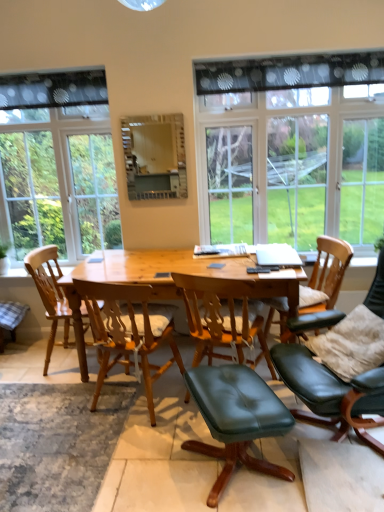
What is the approximate height of black dotted fabric at upper left?

The height of black dotted fabric at upper left is 10.83 inches.

At what (x,y) coordinates should I click in order to perform the action: click on black dotted fabric at upper left. Please return your answer as a coordinate pair (x, y). Looking at the image, I should click on (53, 89).

The height and width of the screenshot is (512, 384). Describe the element at coordinates (169, 280) in the screenshot. I see `natural wood table at center` at that location.

Measure the distance between point [153,423] and camera.

Point [153,423] and camera are 2.39 meters apart.

I want to click on leather cushioned chair at center, which ranks as the 2th chair in right-to-left order, so click(x=220, y=321).

At what (x,y) coordinates should I click in order to perform the action: click on green leather stool at lower center. Please return your answer as a coordinate pair (x, y). Image resolution: width=384 pixels, height=512 pixels. Looking at the image, I should click on (236, 418).

At what (x,y) coordinates should I click in order to perform the action: click on wooden chair at left, the 1th chair from the left. Please return your answer as a coordinate pair (x, y). Image resolution: width=384 pixels, height=512 pixels. Looking at the image, I should click on (49, 293).

What do you see at coordinates (291, 149) in the screenshot? The image size is (384, 512). I see `transparent glass window at upper center, which is the 2th window from left to right` at bounding box center [291, 149].

Find the location of `black dotted fabric at upper left`. black dotted fabric at upper left is located at coordinates (53, 89).

Considering the positions of objects black leather chair at right, the 4th chair from the left, and wooden chair at left, the 1th chair from the left, in the image provided, who is behind, black leather chair at right, the 4th chair from the left, or wooden chair at left, the 1th chair from the left,?

wooden chair at left, the 1th chair from the left, is more distant.

Is black leather chair at right, the 4th chair from the left, facing away from wooden chair at left, the 1th chair from the left?

No, black leather chair at right, the 4th chair from the left, is not facing away from wooden chair at left, the 1th chair from the left.

Which object is thinner, black leather chair at right, the 1th chair in the right-to-left sequence, or wooden chair at left, which is the 4th chair in right-to-left order?

Thinner between the two is wooden chair at left, which is the 4th chair in right-to-left order.

Can you confirm if black leather chair at right, the 1th chair in the right-to-left sequence, is positioned to the left of wooden chair at left, the 1th chair from the left?

No.

From the image's perspective, which one is positioned higher, black leather chair at right, the 4th chair from the left, or black dotted fabric at upper left?

black dotted fabric at upper left, from the image's perspective.

From a real-world perspective, which chair is the 1st one underneath the black dotted fabric at upper left? Please provide its 2D coordinates.

[(331, 393)]

From the picture: Which is more to the left, black leather chair at right, the 4th chair from the left, or black dotted fabric at upper left?

black dotted fabric at upper left.

How different are the orientations of black leather chair at right, the 4th chair from the left, and black dotted fabric at upper left in degrees?

71.7 degrees separate the facing orientations of black leather chair at right, the 4th chair from the left, and black dotted fabric at upper left.

Does natural wood table at center appear on the right side of wooden chair at left, which is the 4th chair in right-to-left order?

Yes, natural wood table at center is to the right of wooden chair at left, which is the 4th chair in right-to-left order.

Do you think natural wood table at center is within wooden chair at left, the 1th chair from the left, or outside of it?

natural wood table at center is located beyond the bounds of wooden chair at left, the 1th chair from the left.

From a real-world perspective, is natural wood table at center above or below wooden chair at left, which is the 4th chair in right-to-left order?

natural wood table at center is below wooden chair at left, which is the 4th chair in right-to-left order.

Considering the relative sizes of black leather chair at right, the 1th chair in the right-to-left sequence, and green leather stool at lower center in the image provided, is black leather chair at right, the 1th chair in the right-to-left sequence, wider than green leather stool at lower center?

Indeed, black leather chair at right, the 1th chair in the right-to-left sequence, has a greater width compared to green leather stool at lower center.

Is point (289, 386) closer to camera compared to point (234, 431)?

No, it is not.

Between black leather chair at right, the 4th chair from the left, and green leather stool at lower center, which one has less height?

With less height is green leather stool at lower center.

Is leather cushioned chair at center, which ranks as the 2th chair in right-to-left order, a part of clear glass window at left, placed as the second window when sorted from right to left?

Actually, leather cushioned chair at center, which ranks as the 2th chair in right-to-left order, is outside clear glass window at left, placed as the second window when sorted from right to left.

Looking at their sizes, would you say clear glass window at left, the first window in the left-to-right sequence, is wider or thinner than leather cushioned chair at center, the third chair viewed from the left?

Considering their sizes, clear glass window at left, the first window in the left-to-right sequence, looks slimmer than leather cushioned chair at center, the third chair viewed from the left.

From a real-world perspective, is clear glass window at left, the first window in the left-to-right sequence, on leather cushioned chair at center, the third chair viewed from the left?

Yes.

Which is closer, [42,89] or [207,333]?

Point [42,89] is positioned farther from the camera compared to point [207,333].

From the image's perspective, between black leather chair at right, the 4th chair from the left, and leather cushioned chair at center, the third chair viewed from the left, who is located below?

From the image's view, black leather chair at right, the 4th chair from the left, is below.

Is black leather chair at right, the 4th chair from the left, in front of leather cushioned chair at center, which ranks as the 2th chair in right-to-left order?

Yes.

From a real-world perspective, relative to leather cushioned chair at center, which ranks as the 2th chair in right-to-left order, is black leather chair at right, the 4th chair from the left, vertically above or below?

From a real-world perspective, black leather chair at right, the 4th chair from the left, is physically above leather cushioned chair at center, which ranks as the 2th chair in right-to-left order.

Is black leather chair at right, the 1th chair in the right-to-left sequence, beside leather cushioned chair at center, the third chair viewed from the left?

No, black leather chair at right, the 1th chair in the right-to-left sequence, is not making contact with leather cushioned chair at center, the third chair viewed from the left.

Is clear glass window at left, placed as the second window when sorted from right to left, at the back of black dotted fabric at upper left?

Yes, clear glass window at left, placed as the second window when sorted from right to left, is at the back of black dotted fabric at upper left.

Which object is positioned more to the right, black dotted fabric at upper left or clear glass window at left, the first window in the left-to-right sequence?

black dotted fabric at upper left.

From their relative heights in the image, would you say black dotted fabric at upper left is taller or shorter than clear glass window at left, placed as the second window when sorted from right to left?

Clearly, black dotted fabric at upper left is shorter compared to clear glass window at left, placed as the second window when sorted from right to left.

How far apart are black dotted fabric at upper left and clear glass window at left, placed as the second window when sorted from right to left?

The distance of black dotted fabric at upper left from clear glass window at left, placed as the second window when sorted from right to left, is 13.49 inches.

Find the location of a particular element. The height and width of the screenshot is (512, 384). the 3rd chair counting from the right side of the wooden chair at left, the 1th chair from the left is located at coordinates (331, 393).

Image resolution: width=384 pixels, height=512 pixels. In order to click on curtain above the black leather chair at right, the 4th chair from the left (from a real-world perspective) in this screenshot , I will do `click(53, 89)`.

Estimate the real-world distances between objects in this image. Which object is further from clear glass window at left, placed as the second window when sorted from right to left, transparent glass window at upper center, which is the 2th window from left to right, or leather cushioned chair at center, which ranks as the 2th chair in right-to-left order?

Based on the image, leather cushioned chair at center, which ranks as the 2th chair in right-to-left order, appears to be further to clear glass window at left, placed as the second window when sorted from right to left.

Looking at the image, which one is located closer to natural wood table at center, clear glass window at left, placed as the second window when sorted from right to left, or black leather chair at right, the 4th chair from the left?

black leather chair at right, the 4th chair from the left, is positioned closer to the anchor natural wood table at center.

In the scene shown: When comparing their distances from clear glass window at left, the first window in the left-to-right sequence, does black leather chair at right, the 1th chair in the right-to-left sequence, or natural wood table at center seem closer?

Among the two, natural wood table at center is located nearer to clear glass window at left, the first window in the left-to-right sequence.

Estimate the real-world distances between objects in this image. Which object is further from leather cushioned chair at center, which ranks as the 2th chair in right-to-left order, black leather chair at right, the 4th chair from the left, or natural wood table at center?

The object further to leather cushioned chair at center, which ranks as the 2th chair in right-to-left order, is black leather chair at right, the 4th chair from the left.

Looking at the image, which one is located further to clear glass window at left, the first window in the left-to-right sequence, wooden chair at center, the third chair in the right-to-left sequence, or black dotted fabric at upper left?

The object further to clear glass window at left, the first window in the left-to-right sequence, is wooden chair at center, the third chair in the right-to-left sequence.

Considering their positions, is wooden chair at left, which is the 4th chair in right-to-left order, positioned further to black leather chair at right, the 1th chair in the right-to-left sequence, than wooden chair at center, the third chair in the right-to-left sequence?

wooden chair at left, which is the 4th chair in right-to-left order, is positioned further to the anchor black leather chair at right, the 1th chair in the right-to-left sequence.

Looking at the image, which one is located further to green leather stool at lower center, wooden chair at center, the second chair in the left-to-right sequence, or leather cushioned chair at center, the third chair viewed from the left?

The object further to green leather stool at lower center is wooden chair at center, the second chair in the left-to-right sequence.

Estimate the real-world distances between objects in this image. Which object is closer to black leather chair at right, the 4th chair from the left, natural wood table at center or clear glass window at left, the first window in the left-to-right sequence?

natural wood table at center is closer to black leather chair at right, the 4th chair from the left.

You are a GUI agent. You are given a task and a screenshot of the screen. Output one action in this format:
    pyautogui.click(x=<x>, y=<y>)
    Task: Click on the kitchen & dining room table that lies between black dotted fabric at upper left and wooden chair at center, the third chair in the right-to-left sequence, from top to bottom
    
    Given the screenshot: What is the action you would take?
    pyautogui.click(x=169, y=280)

Find the location of a particular element. This screenshot has width=384, height=512. stool situated between wooden chair at left, the 1th chair from the left, and black leather chair at right, the 1th chair in the right-to-left sequence, from left to right is located at coordinates (236, 418).

You are a GUI agent. You are given a task and a screenshot of the screen. Output one action in this format:
    pyautogui.click(x=<x>, y=<y>)
    Task: Click on the kitchen & dining room table situated between clear glass window at left, placed as the second window when sorted from right to left, and black leather chair at right, the 4th chair from the left, from left to right
    
    Given the screenshot: What is the action you would take?
    pyautogui.click(x=169, y=280)

Where is `kitchen & dining room table between clear glass window at left, placed as the second window when sorted from right to left, and wooden chair at center, the third chair in the right-to-left sequence, in the vertical direction`? kitchen & dining room table between clear glass window at left, placed as the second window when sorted from right to left, and wooden chair at center, the third chair in the right-to-left sequence, in the vertical direction is located at coordinates (169, 280).